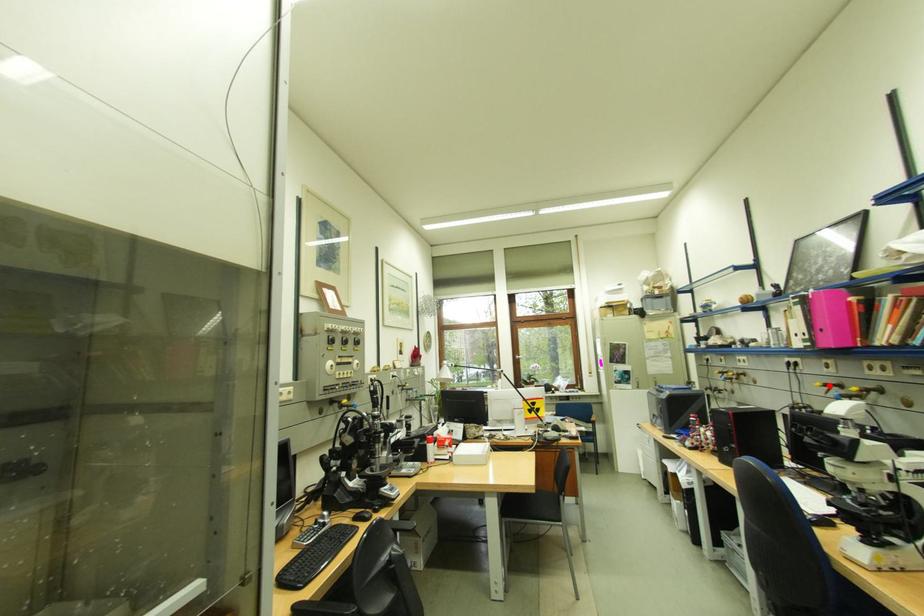
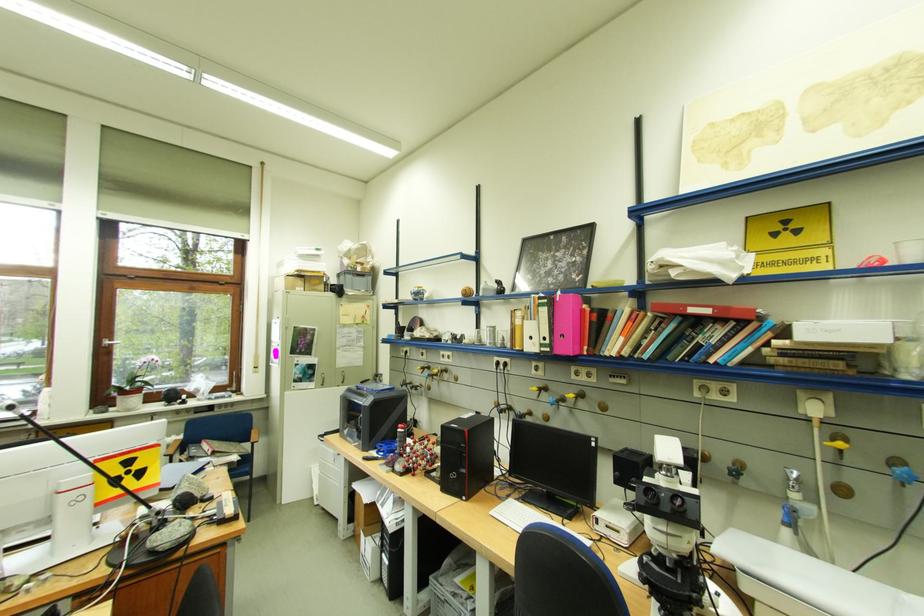
Where in the second image is the point corresponding to the highlighted location from the first image?

(544, 390)